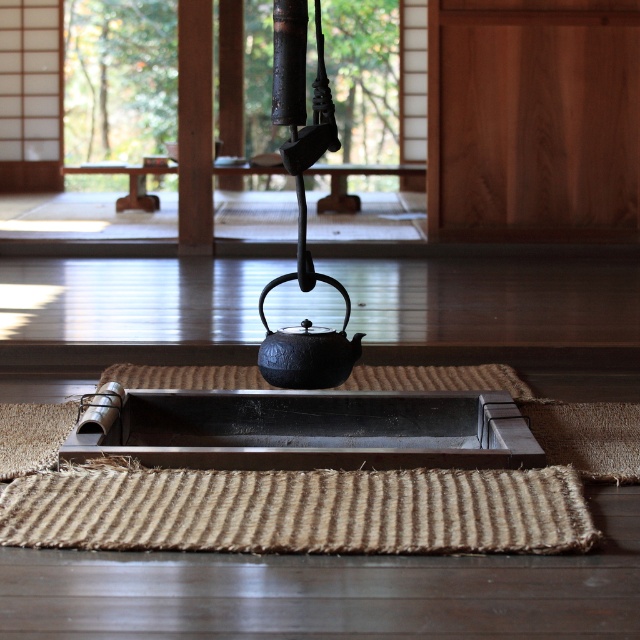
You are a guest at a traditional Japanese tea ceremony and need to place your footwear on the floor. The natural fiber mat at lower center and the sisal rug at center are available. Which one is more suitable for placing your shoes?

The sisal rug at center is thicker and more suitable for placing shoes as the natural fiber mat at lower center is thinner than sisal rug at center.

You are a guest at a traditional Japanese tea ceremony and need to place your footwear. The natural fiber mat at lower center and the sisal rug at center are both available. Which one is more suitable for placing your footwear based on their sizes?

The natural fiber mat at lower center is taller than the sisal rug at center, so it is larger and more suitable for placing footwear.

You are a guest at a traditional Japanese tea ceremony and need to place a small tea cup on the sisal rug at center without it touching the black cast iron teapot at center. Considering their sizes, is this possible?

The sisal rug at center is wider than the black cast iron teapot at center, so placing the tea cup on the rug without touching the teapot is possible as there is enough space.